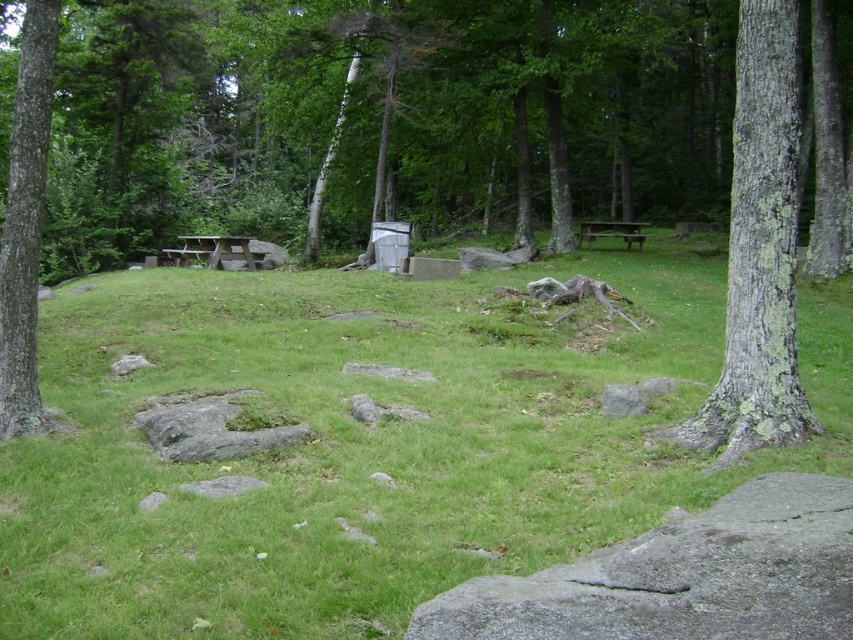
Between point (109, 257) and point (239, 253), which one is positioned in front?

Point (239, 253)

Who is positioned more to the right, green rough bark tree at center or wooden picnic table at center?

Positioned to the right is green rough bark tree at center.

This screenshot has width=853, height=640. Find the location of `green rough bark tree at center`. green rough bark tree at center is located at coordinates point(426,138).

I want to click on green rough bark tree at center, so click(x=426, y=138).

Is green lichen-covered tree trunk at right thinner than wooden picnic table at center?

No.

Is point (730, 202) closer to viewer compared to point (221, 266)?

No, (730, 202) is further to viewer.

You are a GUI agent. You are given a task and a screenshot of the screen. Output one action in this format:
    pyautogui.click(x=<x>, y=<y>)
    Task: Click on the green lichen-covered tree trunk at right
    
    Given the screenshot: What is the action you would take?
    pyautogui.click(x=759, y=252)

You are a GUI agent. You are given a task and a screenshot of the screen. Output one action in this format:
    pyautogui.click(x=<x>, y=<y>)
    Task: Click on the green lichen-covered tree trunk at right
    
    Given the screenshot: What is the action you would take?
    pyautogui.click(x=759, y=252)

You are a GUI agent. You are given a task and a screenshot of the screen. Output one action in this format:
    pyautogui.click(x=<x>, y=<y>)
    Task: Click on the green lichen-covered tree trunk at right
    
    Given the screenshot: What is the action you would take?
    pyautogui.click(x=759, y=252)